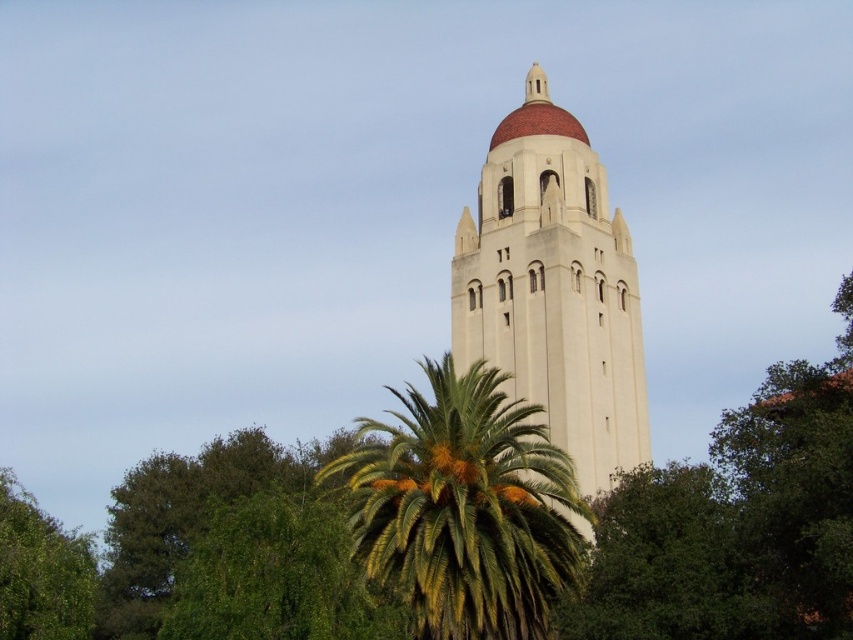
You are a landscape architect designing a path that must pass between the green leafy palm at center and the green leafy tree at lower left. The path needs to be 3 meters wide. Can the space between them accommodate this path?

The green leafy palm at center has a lesser width compared to green leafy tree at lower left. Since the palm is narrower, the space between them may be sufficient for a 3m path, but exact spacing isn

You are standing at the center of the park and want to take a photo of the white stucco tower at center. Based on its coordinates, in which direction should you face to ensure the tower is in the center of your camera frame?

The white stucco tower at center is located at coordinates point (554, 289). Since you are at the center of the park, facing towards the tower would require adjusting your direction to aim slightly to the right and upwards to center it in your camera frame.

You are standing in the park near the palm tree and want to take a photo of the tower with the dome. You have two markers on your camera screen at coordinates point (476, 349) and point (431, 637). Which marker should you use to frame the tower so that the palm tree is not blocking the view?

Point (431, 637) should be used because point (476, 349) is behind point (431, 637), meaning the palm tree might block the view if you use the first marker.